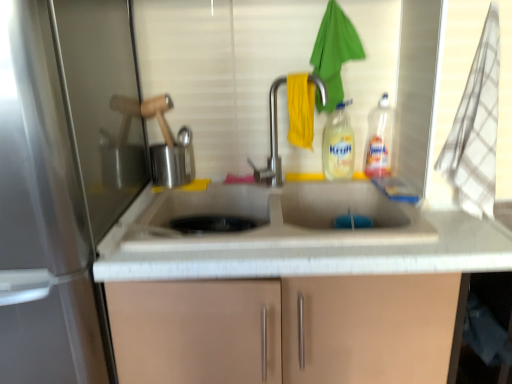
Question: Is brushed metal screen door at left aimed at translucent plastic bottle at upper right, marked as the second bottle in a left-to-right arrangement?

Choices:
 (A) no
 (B) yes

Answer: (A)

Question: Is brushed metal screen door at left facing away from translucent plastic bottle at upper right, marked as the second bottle in a left-to-right arrangement?

Choices:
 (A) yes
 (B) no

Answer: (B)

Question: Is translucent plastic bottle at upper right, positioned as the first bottle in right-to-left order, surrounded by brushed metal screen door at left?

Choices:
 (A) yes
 (B) no

Answer: (B)

Question: Is the position of brushed metal screen door at left more distant than that of translucent plastic bottle at upper right, marked as the second bottle in a left-to-right arrangement?

Choices:
 (A) yes
 (B) no

Answer: (B)

Question: Does brushed metal screen door at left have a larger size compared to translucent plastic bottle at upper right, marked as the second bottle in a left-to-right arrangement?

Choices:
 (A) no
 (B) yes

Answer: (B)

Question: From a real-world perspective, is brushed metal screen door at left on top of translucent plastic bottle at upper right, marked as the second bottle in a left-to-right arrangement?

Choices:
 (A) yes
 (B) no

Answer: (B)

Question: Is translucent plastic bottle at upper right, marked as the second bottle in a left-to-right arrangement, aimed at yellow translucent liquid at center, the second bottle positioned from the right?

Choices:
 (A) no
 (B) yes

Answer: (A)

Question: Does translucent plastic bottle at upper right, marked as the second bottle in a left-to-right arrangement, have a lesser width compared to yellow translucent liquid at center, the second bottle positioned from the right?

Choices:
 (A) no
 (B) yes

Answer: (A)

Question: Can you confirm if translucent plastic bottle at upper right, positioned as the first bottle in right-to-left order, is positioned to the right of yellow translucent liquid at center, the second bottle positioned from the right?

Choices:
 (A) no
 (B) yes

Answer: (B)

Question: Does translucent plastic bottle at upper right, positioned as the first bottle in right-to-left order, have a greater height compared to yellow translucent liquid at center, the 1th bottle positioned from the left?

Choices:
 (A) yes
 (B) no

Answer: (A)

Question: From the image's perspective, would you say translucent plastic bottle at upper right, marked as the second bottle in a left-to-right arrangement, is shown under yellow translucent liquid at center, the second bottle positioned from the right?

Choices:
 (A) yes
 (B) no

Answer: (B)

Question: Is translucent plastic bottle at upper right, positioned as the first bottle in right-to-left order, oriented away from yellow translucent liquid at center, the second bottle positioned from the right?

Choices:
 (A) no
 (B) yes

Answer: (A)

Question: Is satin nickel faucet at center located outside yellow translucent liquid at center, the second bottle positioned from the right?

Choices:
 (A) no
 (B) yes

Answer: (B)